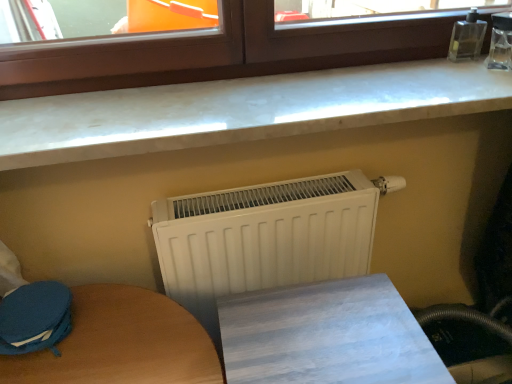
I want to click on vacant space underneath brown wood window at upper center (from a real-world perspective), so click(x=312, y=77).